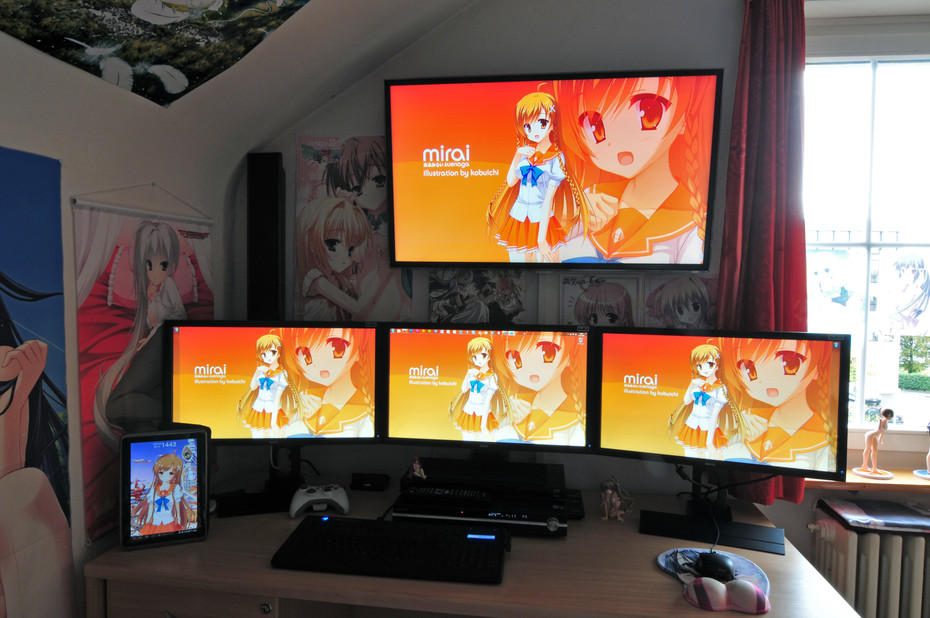
This screenshot has height=618, width=930. Identify the location of screen. [x=448, y=396].